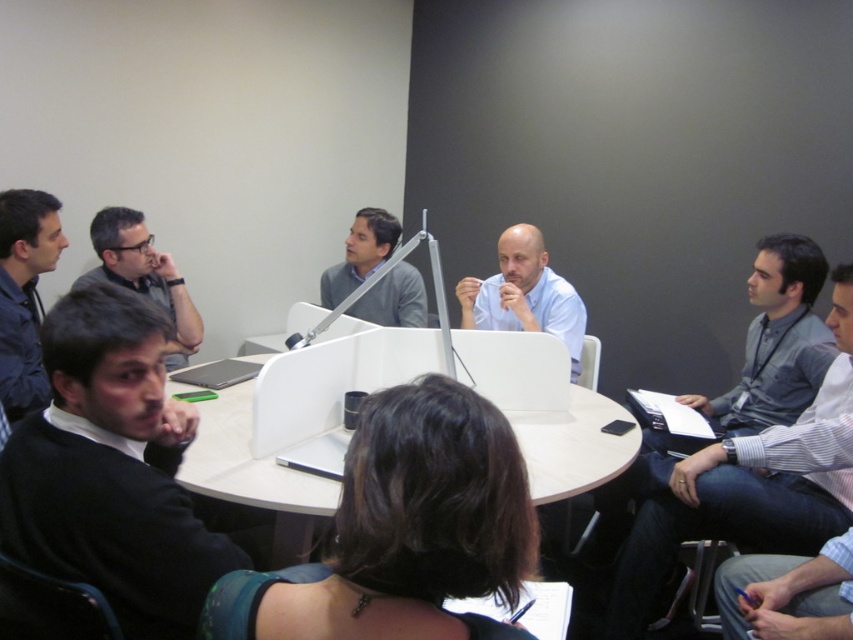
You are organizing a group photo and need to arrange the participants in order of their shirt widths from narrowest to widest. Given the gray striped shirt at right and dark blue shirt at left, which shirt should be placed first in the sequence?

The dark blue shirt at left should be placed first since it is narrower than the gray striped shirt at right.

You are organizing a small conference and need to place a name tag on either the black sweater at lower left or the matte black glasses at upper left. Which object can the name tag fit on better based on their sizes?

The black sweater at lower left is larger in size than the matte black glasses at upper left, so the name tag can fit better on the black sweater at lower left.